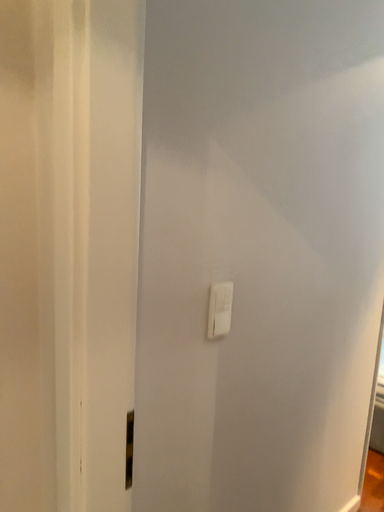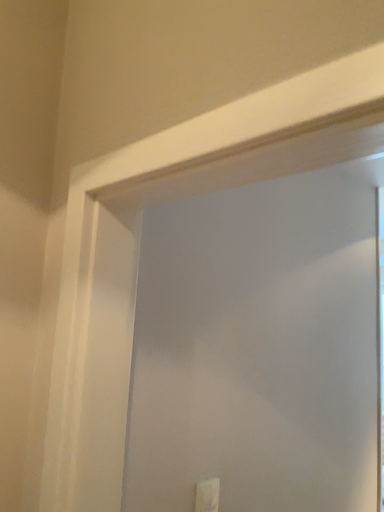
Question: How did the camera likely rotate when shooting the video?

Choices:
 (A) rotated upward
 (B) rotated downward

Answer: (A)